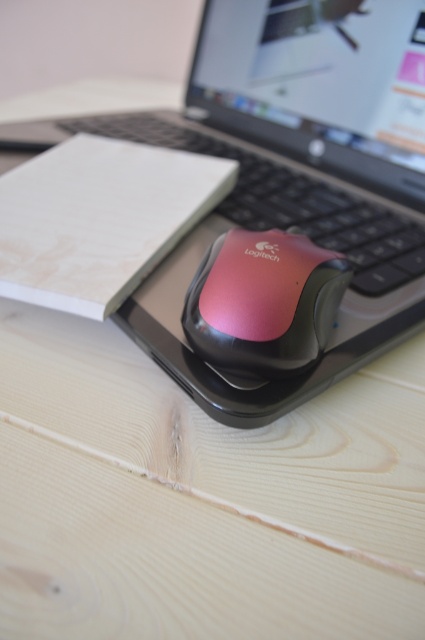
Question: Is black plastic computer at center wider than pink glossy mouse at center?

Choices:
 (A) no
 (B) yes

Answer: (B)

Question: Can you confirm if pink glossy mouse at center is positioned above black plastic keyboard at center?

Choices:
 (A) no
 (B) yes

Answer: (A)

Question: Estimate the real-world distances between objects in this image. Which object is farther from the pink glossy mouse at center?

Choices:
 (A) black plastic computer at center
 (B) black rubber mousepad at center

Answer: (A)

Question: Estimate the real-world distances between objects in this image. Which object is closer to the black rubber mousepad at center?

Choices:
 (A) black plastic keyboard at center
 (B) black plastic computer at center
 (C) pink glossy mouse at center

Answer: (B)

Question: Does black plastic computer at center lie behind black rubber mousepad at center?

Choices:
 (A) yes
 (B) no

Answer: (B)

Question: Which object appears farthest from the camera in this image?

Choices:
 (A) pink glossy mouse at center
 (B) black rubber mousepad at center
 (C) black plastic computer at center

Answer: (B)